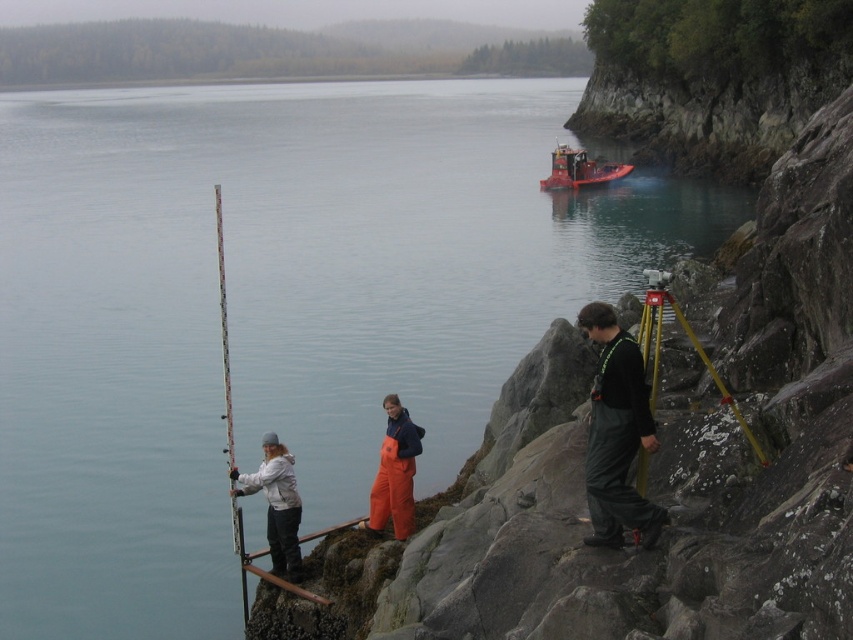
In the scene by the water, there are two people wearing a white fleece jacket at center and orange waterproof overalls at center. Which one is positioned more to the left?

The white fleece jacket at center is positioned more to the left than the orange waterproof overalls at center.

You are a hiker trying to identify two people in the scene. You see a white fleece jacket at center and an orange waterproof overalls at center. Which person is taller?

The white fleece jacket at center is much taller than the orange waterproof overalls at center.

You are a hiker who wants to retrieve the white plastic fishing pole at left. To reach it, you must pass by the orange waterproof overalls at center. Is the fishing pole in front of or behind the overalls?

The white plastic fishing pole at left is behind the orange waterproof overalls at center, so you need to go around or move the overalls to access it.